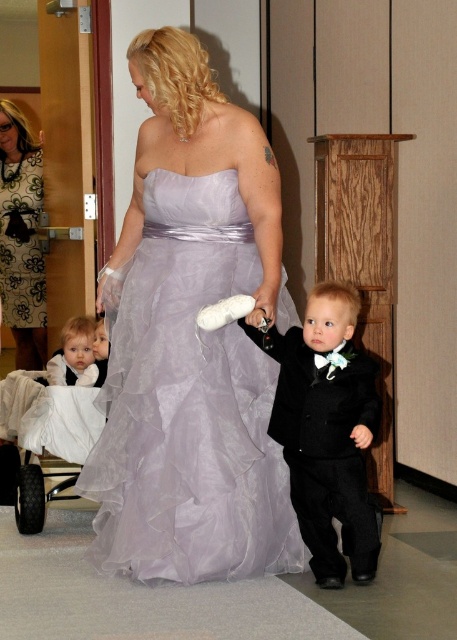
Question: Which point appears closest to the camera in this image?

Choices:
 (A) click(154, 333)
 (B) click(74, 355)
 (C) click(14, 243)

Answer: (A)

Question: Can you confirm if lavender tulle dress at center is thinner than black printed dress at upper left?

Choices:
 (A) no
 (B) yes

Answer: (A)

Question: Is black wool suit at center to the left of white satin dress at left from the viewer's perspective?

Choices:
 (A) yes
 (B) no

Answer: (B)

Question: Which point is closer to the camera?

Choices:
 (A) (315, 388)
 (B) (107, 502)

Answer: (A)

Question: Which of the following is the farthest from the observer?

Choices:
 (A) (176, 310)
 (B) (17, 284)

Answer: (B)

Question: Can you confirm if lavender tulle dress at center is positioned below black wool suit at center?

Choices:
 (A) yes
 (B) no

Answer: (B)